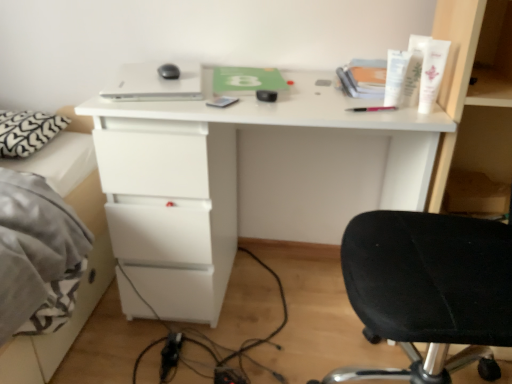
Find the location of a particular element. free area in between matte gray notepad at center and white plastic tube at upper right, which is counted as the 1th toiletry, starting from the right is located at coordinates (310, 107).